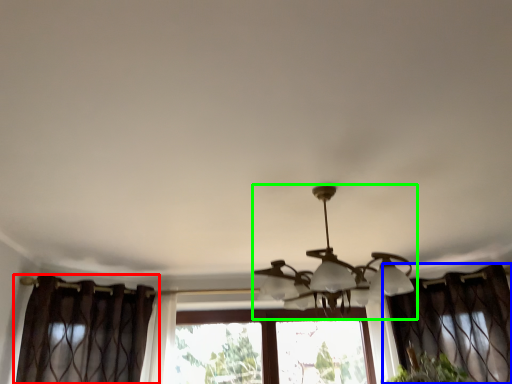
Question: Which object is positioned farthest from curtain (highlighted by a red box)? Select from curtain (highlighted by a blue box) and lamp (highlighted by a green box).

Choices:
 (A) curtain
 (B) lamp

Answer: (A)